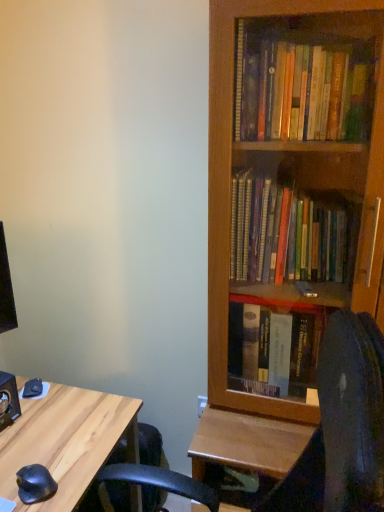
Question: Based on their positions, is wooden bookcase at right located to the left or right of light wood desk at lower left?

Choices:
 (A) right
 (B) left

Answer: (A)

Question: Is point (291, 163) positioned closer to the camera than point (59, 485)?

Choices:
 (A) closer
 (B) farther

Answer: (B)

Question: Which of these objects is positioned closest to the wooden bookcase at right?

Choices:
 (A) black rubber mouse at lower left
 (B) black leather computer chair at lower right
 (C) light wood desk at lower left

Answer: (B)

Question: Estimate the real-world distances between objects in this image. Which object is closer to the black leather computer chair at lower right?

Choices:
 (A) wooden bookcase at right
 (B) black rubber mouse at lower left
 (C) light wood desk at lower left

Answer: (C)